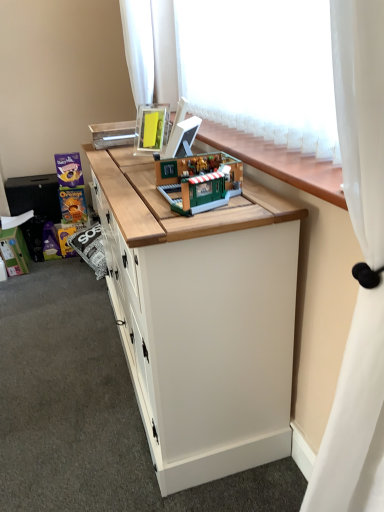
Locate an element on the screen. The image size is (384, 512). vacant area that is situated to the right of brick-like green building at center, the first toy in the right-to-left sequence is located at coordinates (264, 194).